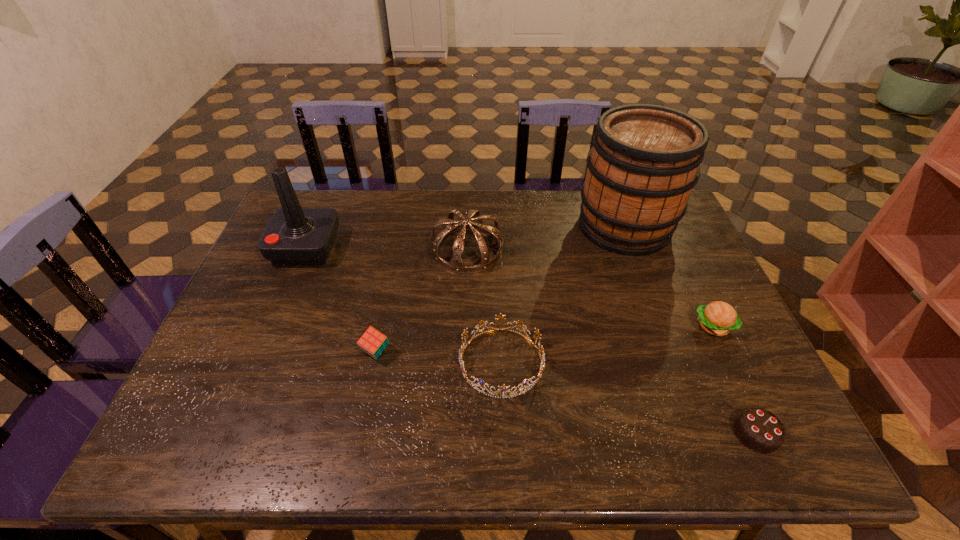
Find the location of a particular element. This screenshot has width=960, height=540. unoccupied area between the nearest object and the cider is located at coordinates (690, 330).

This screenshot has height=540, width=960. What are the coordinates of `free point between the second object from left to right and the shorter tiara` in the screenshot? It's located at (439, 357).

Locate an element on the screen. The height and width of the screenshot is (540, 960). the fifth closest object to the joystick is located at coordinates (718, 318).

You are a GUI agent. You are given a task and a screenshot of the screen. Output one action in this format:
    pyautogui.click(x=<x>, y=<y>)
    Task: Click on the object that stands as the second closest to the fifth shortest object
    This screenshot has height=540, width=960.
    Given the screenshot: What is the action you would take?
    pyautogui.click(x=372, y=342)

Where is `free location that satisfies the following two spatial constraints: 1. on the front-facing side of the nearest object; 2. on the right side of the nearer tiara`? free location that satisfies the following two spatial constraints: 1. on the front-facing side of the nearest object; 2. on the right side of the nearer tiara is located at coordinates (504, 434).

Where is `blank area in the image that satisfies the following two spatial constraints: 1. on the front side of the farther tiara; 2. on the right side of the leftmost object`? blank area in the image that satisfies the following two spatial constraints: 1. on the front side of the farther tiara; 2. on the right side of the leftmost object is located at coordinates (304, 250).

In order to click on free space that satisfies the following two spatial constraints: 1. on the back side of the cider; 2. on the left side of the sixth shortest object in this screenshot , I will do `click(315, 226)`.